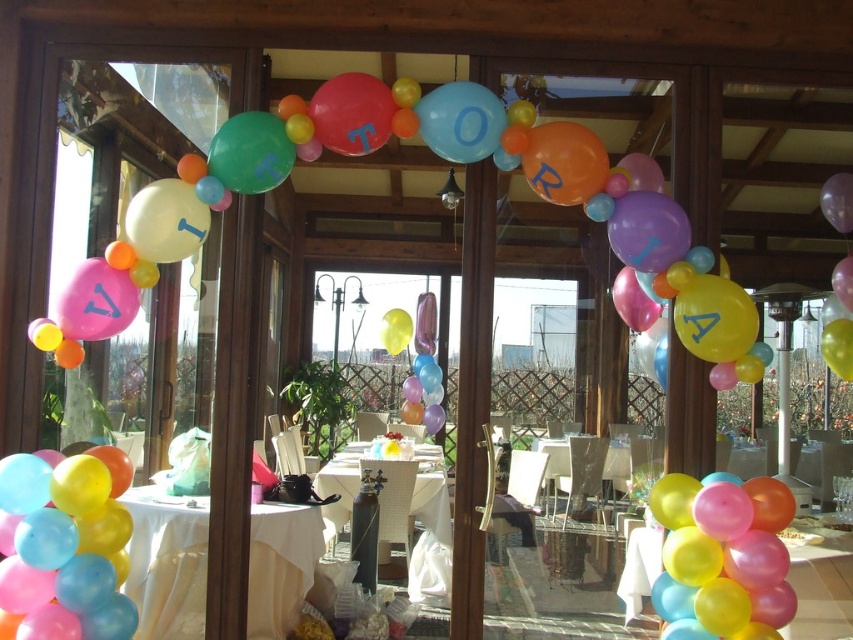
Question: Which of the following is the farthest from the observer?

Choices:
 (A) translucent glossy balloon at lower left
 (B) pastel matte balloons at lower right

Answer: (B)

Question: Observing the image, what is the correct spatial positioning of pastel matte balloons at lower right in reference to metallic silver table at center?

Choices:
 (A) left
 (B) right

Answer: (B)

Question: Which of the following is the closest to the observer?

Choices:
 (A) (431, 513)
 (B) (67, 568)
 (C) (160, 596)
 (D) (729, 516)

Answer: (D)

Question: Is pastel matte balloons at lower right closer to camera compared to metallic silver table at center?

Choices:
 (A) yes
 (B) no

Answer: (A)

Question: Does pastel matte balloons at lower right appear on the left side of white cloth table at center?

Choices:
 (A) yes
 (B) no

Answer: (B)

Question: Which object is closer to the camera taking this photo?

Choices:
 (A) white cloth table at center
 (B) metallic silver table at center
 (C) pastel matte balloons at lower right
 (D) translucent glossy balloon at lower left

Answer: (D)